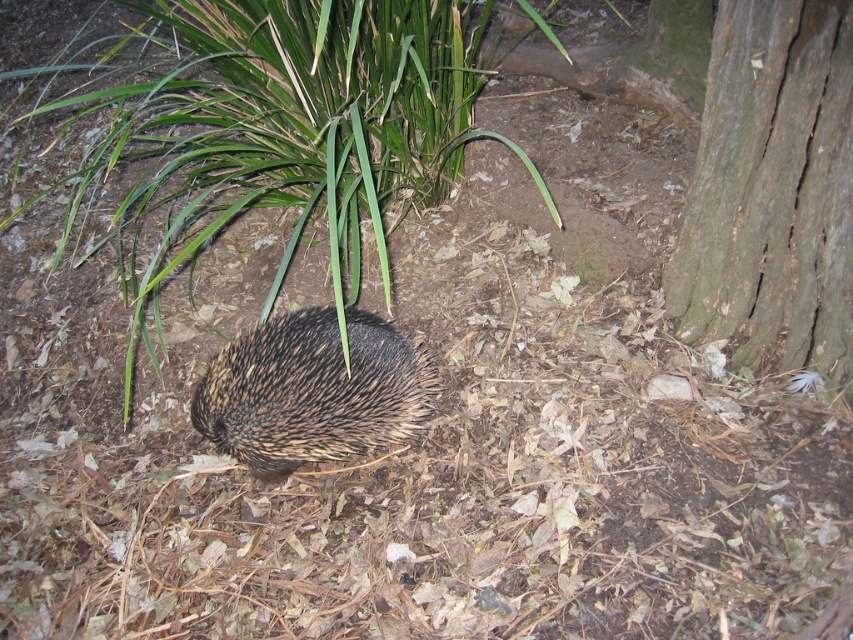
Does dark brown rough bark at right appear under brown spiny hedgehog at center?

No.

Is dark brown rough bark at right positioned behind brown spiny hedgehog at center?

That is False.

Locate an element on the screen. dark brown rough bark at right is located at coordinates (772, 189).

Image resolution: width=853 pixels, height=640 pixels. Find the location of `dark brown rough bark at right`. dark brown rough bark at right is located at coordinates click(772, 189).

Is green leafy grass at center further to the viewer compared to brown spiny hedgehog at center?

That is False.

Is green leafy grass at center smaller than brown spiny hedgehog at center?

No, green leafy grass at center is not smaller than brown spiny hedgehog at center.

Who is more distant from viewer, (358, 292) or (276, 339)?

The point (358, 292) is behind.

This screenshot has height=640, width=853. What are the coordinates of `green leafy grass at center` in the screenshot? It's located at (283, 132).

Does green leafy grass at center appear on the left side of dark brown rough bark at right?

Indeed, green leafy grass at center is positioned on the left side of dark brown rough bark at right.

What do you see at coordinates (283, 132) in the screenshot?
I see `green leafy grass at center` at bounding box center [283, 132].

The height and width of the screenshot is (640, 853). Identify the location of green leafy grass at center. (283, 132).